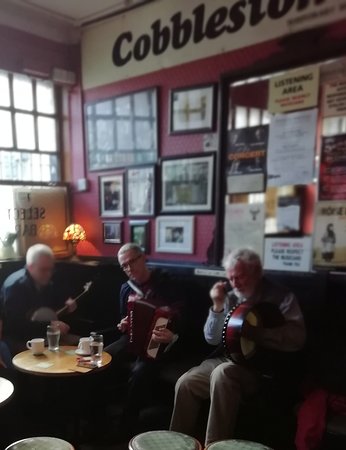
Where is `stools`? stools is located at coordinates (0, 387), (48, 442), (167, 432), (242, 446).